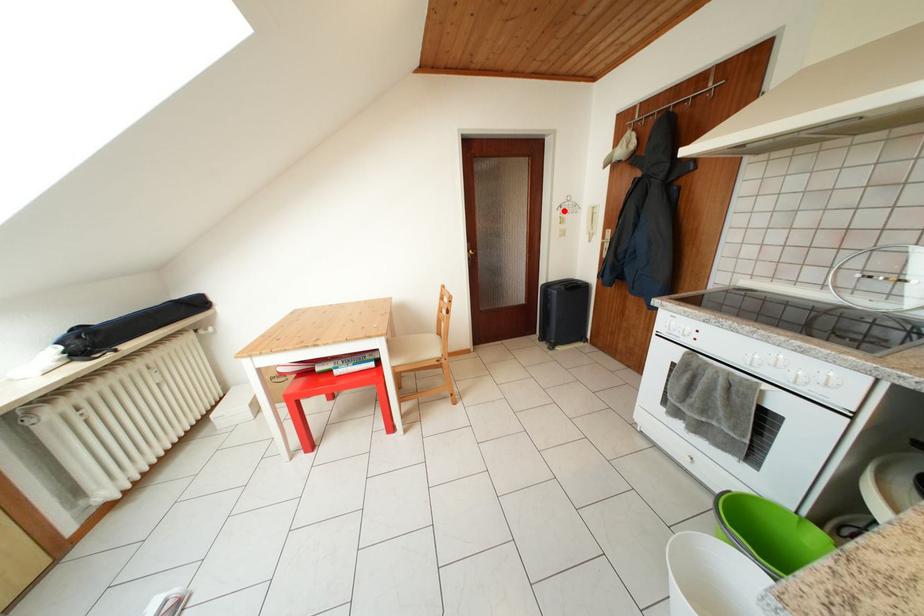
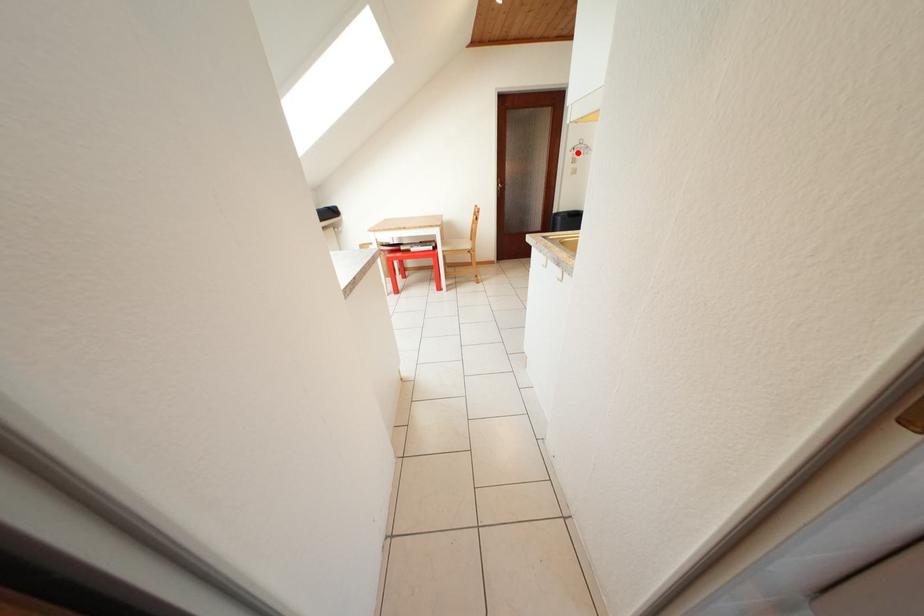
I am providing you with two images of the same scene from different viewpoints. A red point is marked on the first image and another point is marked on the second image. Is the red point in image1 aligned with the point shown in image2?

Yes